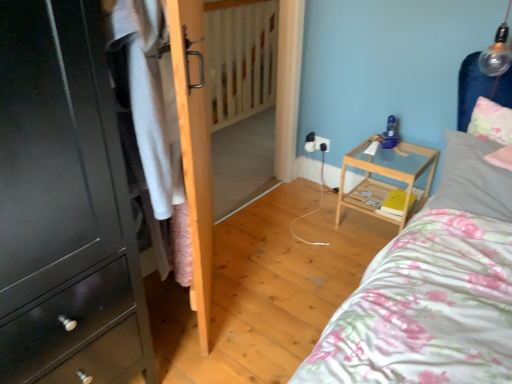
Question: Considering the relative sizes of white cotton shirt at left and fluffy white pillow at upper right, acting as the second pillow starting from the bottom, in the image provided, is white cotton shirt at left taller than fluffy white pillow at upper right, acting as the second pillow starting from the bottom,?

Choices:
 (A) yes
 (B) no

Answer: (A)

Question: Does white cotton shirt at left have a greater width compared to fluffy white pillow at upper right, which is the 1th pillow in top-to-bottom order?

Choices:
 (A) yes
 (B) no

Answer: (A)

Question: Does white cotton shirt at left have a smaller size compared to fluffy white pillow at upper right, acting as the second pillow starting from the bottom?

Choices:
 (A) no
 (B) yes

Answer: (A)

Question: From the image's perspective, is white cotton shirt at left over fluffy white pillow at upper right, which is the 1th pillow in top-to-bottom order?

Choices:
 (A) yes
 (B) no

Answer: (B)

Question: From the image's perspective, is white cotton shirt at left below fluffy white pillow at upper right, which is the 1th pillow in top-to-bottom order?

Choices:
 (A) no
 (B) yes

Answer: (B)

Question: From the image's perspective, relative to white cotton shirt at left, is wooden door at left above or below?

Choices:
 (A) below
 (B) above

Answer: (B)

Question: In terms of size, does wooden door at left appear bigger or smaller than white cotton shirt at left?

Choices:
 (A) big
 (B) small

Answer: (A)

Question: Is wooden door at left taller or shorter than white cotton shirt at left?

Choices:
 (A) tall
 (B) short

Answer: (A)

Question: Do you think wooden door at left is within white cotton shirt at left, or outside of it?

Choices:
 (A) outside
 (B) inside

Answer: (A)

Question: Considering the relative positions of white plastic electric outlet at center and gray fabric pillow at upper right, arranged as the second pillow when viewed from the top, in the image provided, is white plastic electric outlet at center to the left or to the right of gray fabric pillow at upper right, arranged as the second pillow when viewed from the top,?

Choices:
 (A) right
 (B) left

Answer: (B)

Question: In terms of size, does white plastic electric outlet at center appear bigger or smaller than gray fabric pillow at upper right, placed as the 1th pillow when sorted from bottom to top?

Choices:
 (A) small
 (B) big

Answer: (A)

Question: Is white plastic electric outlet at center inside the boundaries of gray fabric pillow at upper right, arranged as the second pillow when viewed from the top, or outside?

Choices:
 (A) outside
 (B) inside

Answer: (A)

Question: Is point (315, 142) positioned closer to the camera than point (449, 175)?

Choices:
 (A) closer
 (B) farther

Answer: (B)

Question: From a real-world perspective, is gray fabric pillow at upper right, placed as the 1th pillow when sorted from bottom to top, positioned above or below white plastic electric outlet at center?

Choices:
 (A) below
 (B) above

Answer: (B)

Question: From the image's perspective, is gray fabric pillow at upper right, placed as the 1th pillow when sorted from bottom to top, located above or below white plastic electric outlet at center?

Choices:
 (A) below
 (B) above

Answer: (A)